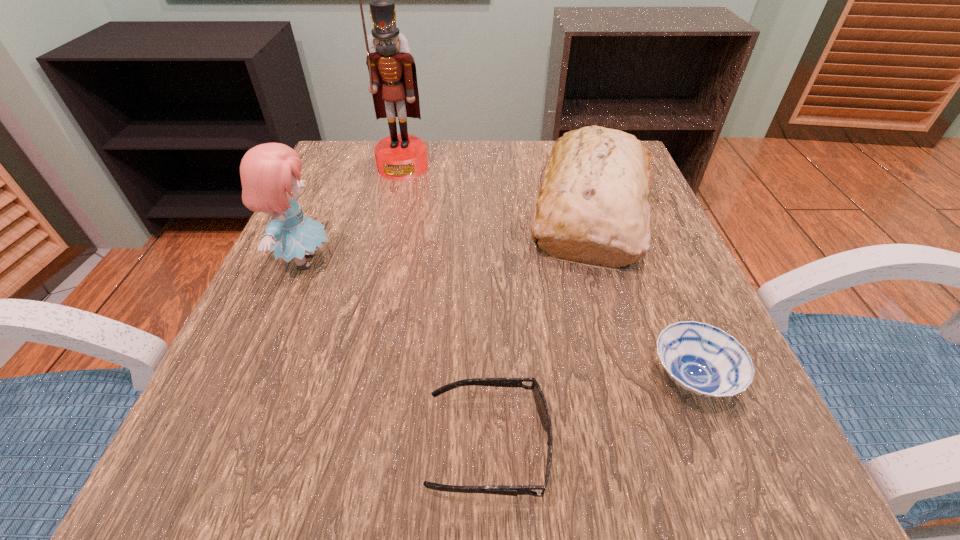
I want to click on vacant space located 0.360m on the back of the soup bowl, so click(x=622, y=207).

Locate an element on the screen. free space located 0.200m on the front-facing side of the third object from right to left is located at coordinates (271, 446).

What are the coordinates of `free space located 0.120m on the front-facing side of the third object from right to left` in the screenshot? It's located at (334, 446).

This screenshot has height=540, width=960. Find the location of `free space located 0.050m on the front-facing side of the third object from right to left`. free space located 0.050m on the front-facing side of the third object from right to left is located at coordinates (390, 446).

Identify the location of nutcracker present at the far edge. Image resolution: width=960 pixels, height=540 pixels. (393, 79).

The height and width of the screenshot is (540, 960). I want to click on bread at the far edge, so click(593, 206).

The width and height of the screenshot is (960, 540). Find the location of `object located at the near edge`. object located at the near edge is located at coordinates (541, 405).

You are a GUI agent. You are given a task and a screenshot of the screen. Output one action in this format:
    pyautogui.click(x=<x>, y=<y>)
    Task: Click on the nutcracker present at the left edge
    This screenshot has height=540, width=960.
    Given the screenshot: What is the action you would take?
    pyautogui.click(x=393, y=79)

Find the location of a particular element. This screenshot has width=960, height=540. doll that is at the left edge is located at coordinates (270, 173).

The image size is (960, 540). I want to click on bread that is at the right edge, so click(x=593, y=206).